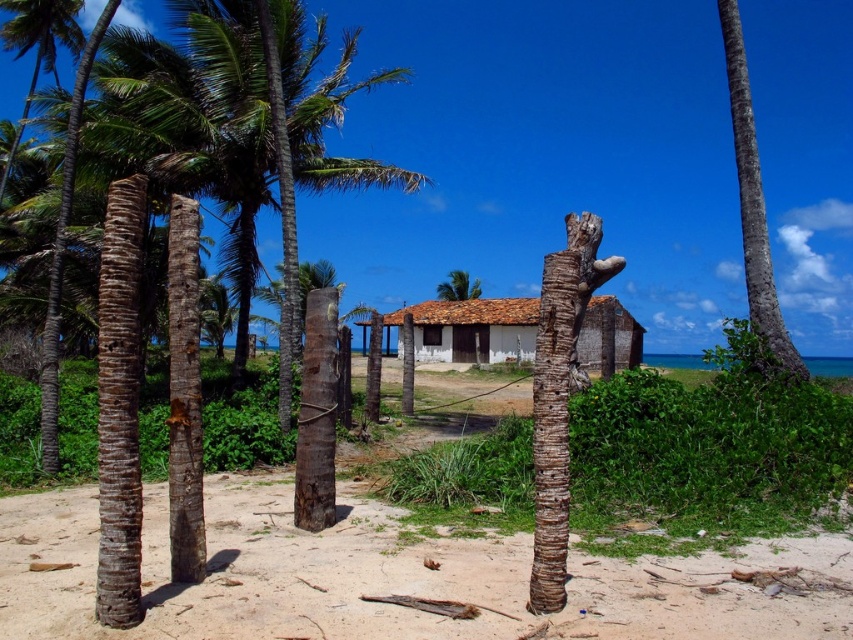
You are planning to install a solar panel on the tallest structure in the scene. Which structure should you choose between the white wooden hut at center and the brown rough bark tree at right?

The brown rough bark tree at right is taller than the white wooden hut at center, so you should install the solar panel on the brown rough bark tree at right.